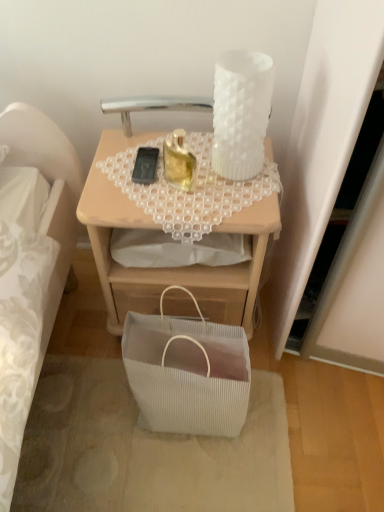
Where is `free space in front of white frosted glass candle holder at upper right, the 2th candle holder from the left`? The image size is (384, 512). free space in front of white frosted glass candle holder at upper right, the 2th candle holder from the left is located at coordinates (228, 196).